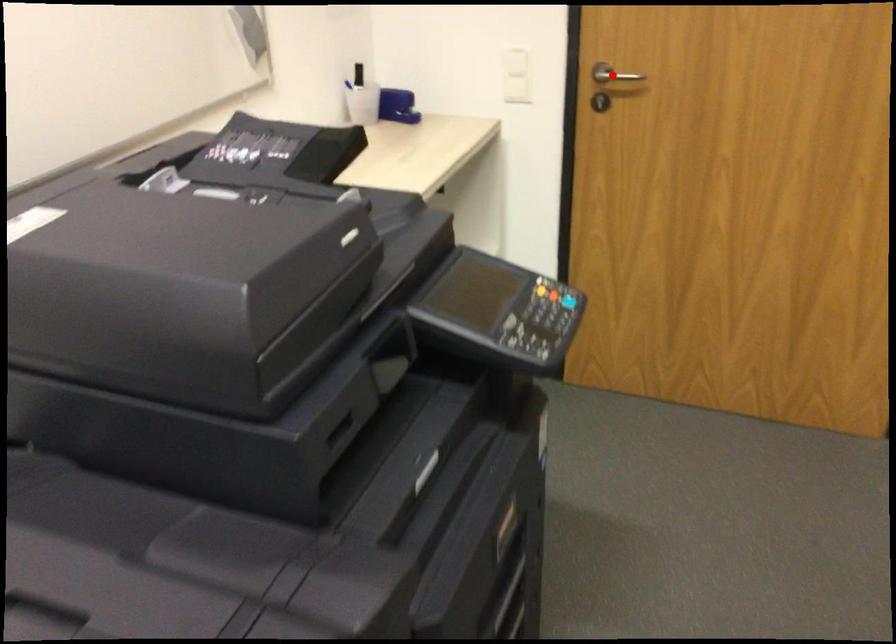
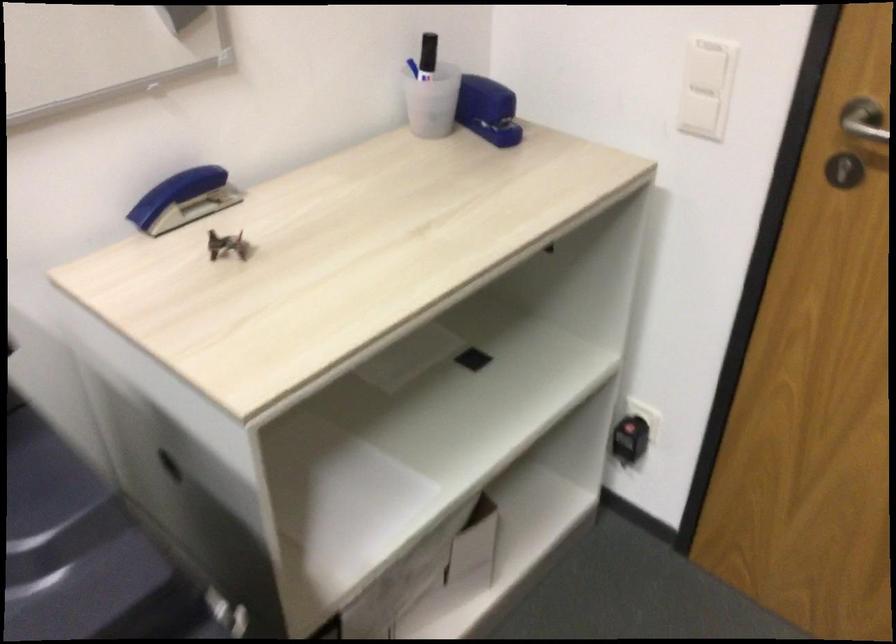
In the second image, find the point that corresponds to the highlighted location in the first image.

(864, 120)